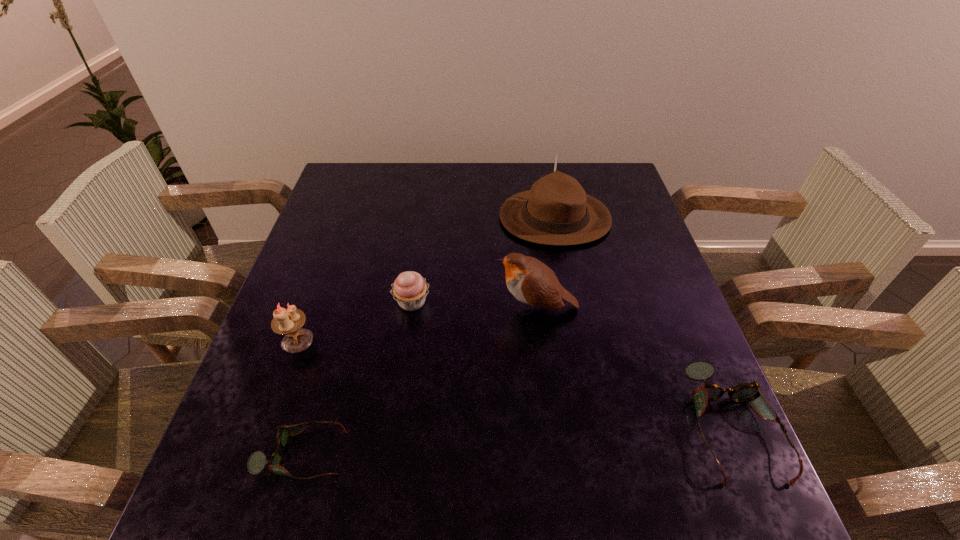
If the aim is uniform spacing by inserting an additional spectacles among them, please point to a vacant space for this new spectacles. Please provide its 2D coordinates. Your answer should be formatted as a tuple, i.e. [(x, y)], where the tuple contains the x and y coordinates of a point satisfying the conditions above.

[(521, 439)]